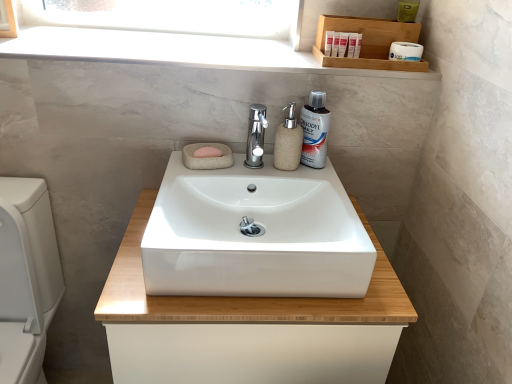
Question: Considering the relative sizes of white glossy toilet at lower left and white glossy mouthwash at upper right in the image provided, is white glossy toilet at lower left wider than white glossy mouthwash at upper right?

Choices:
 (A) yes
 (B) no

Answer: (A)

Question: Is white glossy toilet at lower left thinner than white glossy mouthwash at upper right?

Choices:
 (A) no
 (B) yes

Answer: (A)

Question: Is white glossy toilet at lower left next to white glossy mouthwash at upper right?

Choices:
 (A) no
 (B) yes

Answer: (A)

Question: Is white glossy toilet at lower left far from white glossy mouthwash at upper right?

Choices:
 (A) no
 (B) yes

Answer: (A)

Question: Is white glossy toilet at lower left positioned with its back to white glossy mouthwash at upper right?

Choices:
 (A) no
 (B) yes

Answer: (A)

Question: Looking at the image, does white marble window sill at upper center seem bigger or smaller compared to pink stone soap at center?

Choices:
 (A) small
 (B) big

Answer: (B)

Question: From a real-world perspective, is white marble window sill at upper center physically located above or below pink stone soap at center?

Choices:
 (A) below
 (B) above

Answer: (B)

Question: Is white marble window sill at upper center wider or thinner than pink stone soap at center?

Choices:
 (A) thin
 (B) wide

Answer: (B)

Question: Considering the positions of white marble window sill at upper center and pink stone soap at center in the image, is white marble window sill at upper center taller or shorter than pink stone soap at center?

Choices:
 (A) short
 (B) tall

Answer: (A)

Question: In terms of height, does white glossy toilet at lower left look taller or shorter compared to white marble window sill at upper center?

Choices:
 (A) tall
 (B) short

Answer: (A)

Question: Based on their sizes in the image, would you say white glossy toilet at lower left is bigger or smaller than white marble window sill at upper center?

Choices:
 (A) big
 (B) small

Answer: (A)

Question: Is point (12, 274) positioned closer to the camera than point (90, 31)?

Choices:
 (A) farther
 (B) closer

Answer: (B)

Question: Is white glossy toilet at lower left situated inside white marble window sill at upper center or outside?

Choices:
 (A) outside
 (B) inside

Answer: (A)

Question: Looking at the image, does white glossy sink at center seem bigger or smaller compared to polished chrome tap at center?

Choices:
 (A) small
 (B) big

Answer: (B)

Question: From the image's perspective, is white glossy sink at center positioned above or below polished chrome tap at center?

Choices:
 (A) below
 (B) above

Answer: (A)